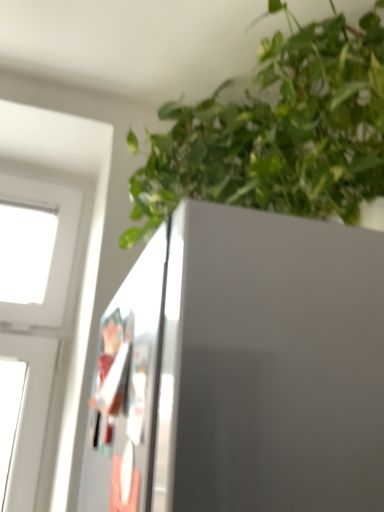
In order to face green leafy plant at upper right, should I rotate leftwards or rightwards?

Rotate your view right by about 10.165°.

The width and height of the screenshot is (384, 512). Identify the location of green leafy plant at upper right. pos(279,132).

The height and width of the screenshot is (512, 384). What do you see at coordinates (279, 132) in the screenshot?
I see `green leafy plant at upper right` at bounding box center [279, 132].

Where is `transparent plastic screen door at left`? This screenshot has height=512, width=384. transparent plastic screen door at left is located at coordinates (127, 388).

Describe the element at coordinates (127, 388) in the screenshot. Image resolution: width=384 pixels, height=512 pixels. I see `transparent plastic screen door at left` at that location.

I want to click on green leafy plant at upper right, so click(x=279, y=132).

Considering the relative positions of green leafy plant at upper right and transparent plastic screen door at left in the image provided, is green leafy plant at upper right to the left of transparent plastic screen door at left from the viewer's perspective?

No.

Consider the image. Considering the relative positions of green leafy plant at upper right and transparent plastic screen door at left in the image provided, is green leafy plant at upper right behind transparent plastic screen door at left?

Yes, green leafy plant at upper right is further from the viewer.

Is point (328, 41) more distant than point (89, 420)?

That is True.

From the image's perspective, is green leafy plant at upper right below transparent plastic screen door at left?

No, from the image's perspective, green leafy plant at upper right is not below transparent plastic screen door at left.

From a real-world perspective, between green leafy plant at upper right and transparent plastic screen door at left, who is vertically higher?

green leafy plant at upper right is physically above.

Between green leafy plant at upper right and transparent plastic screen door at left, which one has smaller width?

With smaller width is transparent plastic screen door at left.

Who is shorter, green leafy plant at upper right or transparent plastic screen door at left?

Standing shorter between the two is transparent plastic screen door at left.

Looking at this image, which of these two, green leafy plant at upper right or transparent plastic screen door at left, is bigger?

green leafy plant at upper right.

Based on the photo, can we say green leafy plant at upper right lies outside transparent plastic screen door at left?

That's correct, green leafy plant at upper right is outside of transparent plastic screen door at left.

Would you say green leafy plant at upper right is a long distance from transparent plastic screen door at left?

Actually, green leafy plant at upper right and transparent plastic screen door at left are a little close together.

Is green leafy plant at upper right oriented towards transparent plastic screen door at left?

No, green leafy plant at upper right is not turned towards transparent plastic screen door at left.

Can you tell me how much green leafy plant at upper right and transparent plastic screen door at left differ in facing direction?

1.49 degrees.

Find the location of `screen door below the green leafy plant at upper right (from a real-world perspective)`. screen door below the green leafy plant at upper right (from a real-world perspective) is located at coordinates (127, 388).

In the image, is transparent plastic screen door at left on the left side or the right side of green leafy plant at upper right?

transparent plastic screen door at left is to the left of green leafy plant at upper right.

Is the depth of transparent plastic screen door at left less than that of green leafy plant at upper right?

Yes, transparent plastic screen door at left is closer to the camera.

Which is nearer, (117,461) or (190,109)?

Point (117,461).

From the image's perspective, is transparent plastic screen door at left located above or below green leafy plant at upper right?

transparent plastic screen door at left is situated lower than green leafy plant at upper right in the image.

From a real-world perspective, which is physically above, transparent plastic screen door at left or green leafy plant at upper right?

From a 3D spatial view, green leafy plant at upper right is above.

Based on the photo, which of these two, transparent plastic screen door at left or green leafy plant at upper right, is thinner?

transparent plastic screen door at left is thinner.

From their relative heights in the image, would you say transparent plastic screen door at left is taller or shorter than green leafy plant at upper right?

Clearly, transparent plastic screen door at left is shorter compared to green leafy plant at upper right.

Considering the relative sizes of transparent plastic screen door at left and green leafy plant at upper right in the image provided, is transparent plastic screen door at left bigger than green leafy plant at upper right?

Incorrect, transparent plastic screen door at left is not larger than green leafy plant at upper right.

From the picture: Is transparent plastic screen door at left inside or outside of green leafy plant at upper right?

The correct answer is: outside.

Are transparent plastic screen door at left and green leafy plant at upper right making contact?

There is a gap between transparent plastic screen door at left and green leafy plant at upper right.

Is transparent plastic screen door at left facing towards green leafy plant at upper right?

No, transparent plastic screen door at left is not aimed at green leafy plant at upper right.

What's the angular difference between transparent plastic screen door at left and green leafy plant at upper right's facing directions?

The angle between the facing direction of transparent plastic screen door at left and the facing direction of green leafy plant at upper right is 1.49 degrees.

How far apart are transparent plastic screen door at left and green leafy plant at upper right?

They are 18.22 inches apart.

Find the location of a particular element. houseplant behind the transparent plastic screen door at left is located at coordinates 279,132.

At what (x,y) coordinates should I click in order to perform the action: click on houseplant on the right of transparent plastic screen door at left. Please return your answer as a coordinate pair (x, y). This screenshot has height=512, width=384. Looking at the image, I should click on (279, 132).

In the image, there is a green leafy plant at upper right. At what (x,y) coordinates should I click in order to perform the action: click on screen door below it (from the image's perspective). Please return your answer as a coordinate pair (x, y). This screenshot has height=512, width=384. Looking at the image, I should click on point(127,388).